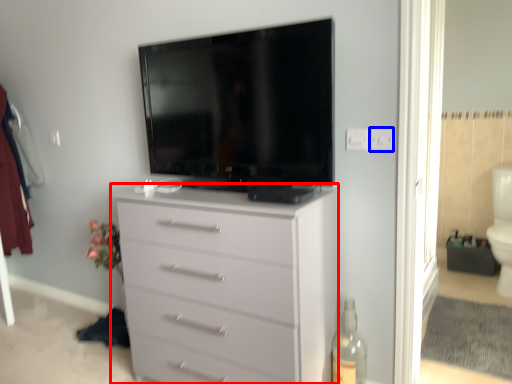
Question: Which of the following is the farthest to the observer, chest of drawers (highlighted by a red box) or electric outlet (highlighted by a blue box)?

Choices:
 (A) chest of drawers
 (B) electric outlet

Answer: (B)